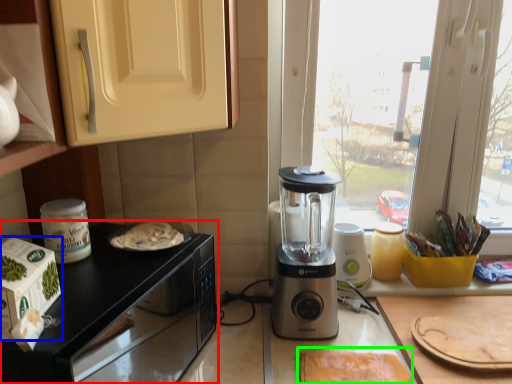
Question: Based on their relative distances, which object is nearer to countertop (highlighted by a red box)? Choose from home appliance (highlighted by a blue box) and food (highlighted by a green box).

Choices:
 (A) home appliance
 (B) food

Answer: (A)